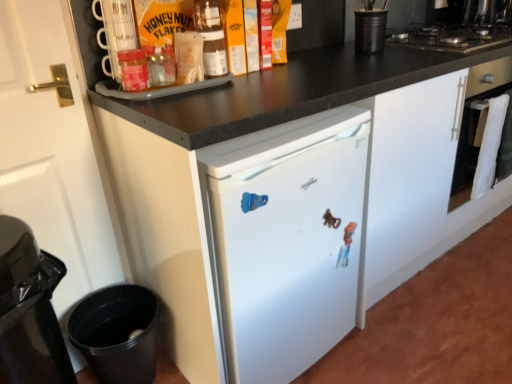
Describe the element at coordinates (133, 69) in the screenshot. The width and height of the screenshot is (512, 384). I see `matte glass jar at upper left, placed as the 1th bottle when sorted from front to back` at that location.

Measure the distance between point [140,70] and camera.

1.16 meters.

Where is `white matte door at left`? The height and width of the screenshot is (384, 512). white matte door at left is located at coordinates (54, 153).

Find the location of a particular element. This screenshot has height=384, width=512. white glossy oven at right is located at coordinates (479, 147).

Measure the distance between point [382,26] and camera.

Point [382,26] is 1.57 meters away from camera.

What do you see at coordinates (452, 37) in the screenshot? I see `black matte gas stove at upper right` at bounding box center [452, 37].

Where is `black plastic trash can at lower left, placed as the 1th appliance when sorted from bottom to top`? The image size is (512, 384). black plastic trash can at lower left, placed as the 1th appliance when sorted from bottom to top is located at coordinates click(117, 333).

Measure the distance between point (210, 66) and camera.

Point (210, 66) is 4.16 feet from camera.

In order to face matte glass honey jar at upper center, which ranks as the 1th bottle in top-to-bottom order, should I rotate leftwards or rightwards?

It's best to rotate left around 5.035 degrees.

Locate an element on the screen. This screenshot has width=512, height=384. matte glass jar at upper left, positioned as the 1th bottle in bottom-to-top order is located at coordinates (133, 69).

Is the surface of black matte cup at upper right, marked as the second appliance in a bottom-to-top arrangement, in direct contact with matte glass honey jar at upper center, positioned as the 1th bottle in right-to-left order?

black matte cup at upper right, marked as the second appliance in a bottom-to-top arrangement, and matte glass honey jar at upper center, positioned as the 1th bottle in right-to-left order, are clearly separated.

Is black matte cup at upper right, which is counted as the 2th appliance, starting from the left, taller than matte glass honey jar at upper center, which is the first bottle in back-to-front order?

No, black matte cup at upper right, which is counted as the 2th appliance, starting from the left, is not taller than matte glass honey jar at upper center, which is the first bottle in back-to-front order.

From the image's perspective, does black matte cup at upper right, which ranks as the first appliance in right-to-left order, appear lower than matte glass honey jar at upper center, which ranks as the 1th bottle in top-to-bottom order?

Actually, black matte cup at upper right, which ranks as the first appliance in right-to-left order, appears above matte glass honey jar at upper center, which ranks as the 1th bottle in top-to-bottom order, in the image.

In the scene shown: Between matte glass jar at upper left, which is counted as the 2th bottle, starting from the back, and plastic toy at center, which one appears on the left side from the viewer's perspective?

From the viewer's perspective, matte glass jar at upper left, which is counted as the 2th bottle, starting from the back, appears more on the left side.

Can you confirm if matte glass jar at upper left, which is the 2th bottle in top-to-bottom order, is wider than plastic toy at center?

Indeed, matte glass jar at upper left, which is the 2th bottle in top-to-bottom order, has a greater width compared to plastic toy at center.

How much distance is there between matte glass jar at upper left, the first bottle positioned from the left, and plastic toy at center?

matte glass jar at upper left, the first bottle positioned from the left, is 30.04 inches from plastic toy at center.

From a real-world perspective, does matte glass jar at upper left, positioned as the 1th bottle in bottom-to-top order, sit lower than plastic toy at center?

Actually, matte glass jar at upper left, positioned as the 1th bottle in bottom-to-top order, is physically above plastic toy at center in the real world.

Does matte glass honey jar at upper center, which is the first bottle in back-to-front order, have a lesser height compared to black plastic trash can at lower left, placed as the 1th appliance when sorted from bottom to top?

Indeed, matte glass honey jar at upper center, which is the first bottle in back-to-front order, has a lesser height compared to black plastic trash can at lower left, placed as the 1th appliance when sorted from bottom to top.

Choose the correct answer: Is matte glass honey jar at upper center, which appears as the 2th bottle when viewed from the front, inside black plastic trash can at lower left, positioned as the second appliance in top-to-bottom order, or outside it?

matte glass honey jar at upper center, which appears as the 2th bottle when viewed from the front, is not inside black plastic trash can at lower left, positioned as the second appliance in top-to-bottom order, it's outside.

Is matte glass honey jar at upper center, which appears as the 2th bottle when viewed from the front, wider or thinner than black plastic trash can at lower left, the first appliance positioned from the left?

Clearly, matte glass honey jar at upper center, which appears as the 2th bottle when viewed from the front, has less width compared to black plastic trash can at lower left, the first appliance positioned from the left.

Is matte glass honey jar at upper center, which ranks as the 1th bottle in top-to-bottom order, behind black plastic trash can at lower left, arranged as the second appliance when viewed from the right?

Yes, matte glass honey jar at upper center, which ranks as the 1th bottle in top-to-bottom order, is behind black plastic trash can at lower left, arranged as the second appliance when viewed from the right.

From a real-world perspective, is white matte door at left physically above black matte gas stove at upper right?

Incorrect, from a real-world perspective, white matte door at left is lower than black matte gas stove at upper right.

Considering the positions of points (98, 205) and (465, 36), is point (98, 205) farther from camera compared to point (465, 36)?

No, (98, 205) is closer to viewer.

Image resolution: width=512 pixels, height=384 pixels. I want to click on gas stove lying above the white matte door at left (from the image's perspective), so click(452, 37).

Is white matte door at left facing towards black matte gas stove at upper right?

No, white matte door at left is not turned towards black matte gas stove at upper right.

Are matte glass honey jar at upper center, which is counted as the second bottle, starting from the bottom, and black matte cup at upper right, marked as the second appliance in a bottom-to-top arrangement, beside each other?

No, matte glass honey jar at upper center, which is counted as the second bottle, starting from the bottom, is not beside black matte cup at upper right, marked as the second appliance in a bottom-to-top arrangement.

From a real-world perspective, is matte glass honey jar at upper center, which ranks as the 1th bottle in top-to-bottom order, positioned under black matte cup at upper right, which ranks as the first appliance in right-to-left order, based on gravity?

No.

Considering the positions of point (200, 11) and point (360, 25), is point (200, 11) closer or farther from the camera than point (360, 25)?

Point (200, 11) is positioned closer to the camera compared to point (360, 25).

From the image's perspective, is black glossy trash can at lower left beneath black matte cup at upper right, marked as the second appliance in a bottom-to-top arrangement?

Correct, black glossy trash can at lower left appears lower than black matte cup at upper right, marked as the second appliance in a bottom-to-top arrangement, in the image.

Is black glossy trash can at lower left next to black matte cup at upper right, which ranks as the first appliance in right-to-left order?

No, black glossy trash can at lower left is not with black matte cup at upper right, which ranks as the first appliance in right-to-left order.

Is black matte cup at upper right, marked as the second appliance in a bottom-to-top arrangement, inside black glossy trash can at lower left?

No, black glossy trash can at lower left does not contain black matte cup at upper right, marked as the second appliance in a bottom-to-top arrangement.

Is plastic toy at center at the back of black glossy trash can at lower left?

No, black glossy trash can at lower left is not facing away from plastic toy at center.

From a real-world perspective, is black glossy trash can at lower left positioned above or below plastic toy at center?

In terms of real-world spatial position, black glossy trash can at lower left is below plastic toy at center.

How different are the orientations of black glossy trash can at lower left and plastic toy at center in degrees?

0.472 degrees separate the facing orientations of black glossy trash can at lower left and plastic toy at center.

Would you say black glossy trash can at lower left is inside or outside plastic toy at center?

black glossy trash can at lower left exists outside the volume of plastic toy at center.

The width and height of the screenshot is (512, 384). In the image, there is a matte glass honey jar at upper center, positioned as the 1th bottle in right-to-left order. Find the location of `appliance above it (from the image's perspective)`. appliance above it (from the image's perspective) is located at coordinates (370, 30).

Starting from the plastic toy at center, which bottle is the 2nd one to the left? Please provide its 2D coordinates.

[(133, 69)]

Considering their positions, is matte glass honey jar at upper center, which appears as the 2th bottle when viewed from the front, positioned further to matte glass jar at upper left, the first bottle positioned from the left, than white matte door at left?

white matte door at left.

From the image, which object appears to be farther from plastic toy at center, white matte door at left or matte glass jar at upper left, the first bottle positioned from the left?

Among the two, white matte door at left is located further to plastic toy at center.

Considering their positions, is plastic toy at center positioned closer to matte glass jar at upper left, which is counted as the 2th bottle, starting from the back, than white matte door at left?

white matte door at left is positioned closer to the anchor matte glass jar at upper left, which is counted as the 2th bottle, starting from the back.

Looking at the image, which one is located further to plastic toy at center, black matte cup at upper right, the first appliance from the top, or black matte gas stove at upper right?

Among the two, black matte gas stove at upper right is located further to plastic toy at center.

Looking at the image, which one is located further to matte glass jar at upper left, placed as the 1th bottle when sorted from front to back, black glossy trash can at lower left or white glossy oven at right?

white glossy oven at right is further to matte glass jar at upper left, placed as the 1th bottle when sorted from front to back.

Considering their positions, is white matte door at left positioned closer to matte glass honey jar at upper center, which ranks as the 1th bottle in top-to-bottom order, than plastic toy at center?

white matte door at left lies closer to matte glass honey jar at upper center, which ranks as the 1th bottle in top-to-bottom order, than the other object.

When comparing their distances from plastic toy at center, does white glossy oven at right or black plastic trash can at lower left, placed as the 1th appliance when sorted from bottom to top, seem closer?

The object closer to plastic toy at center is white glossy oven at right.

Based on their spatial positions, is white matte door at left or white glossy oven at right further from black matte gas stove at upper right?

white matte door at left.

This screenshot has width=512, height=384. In order to click on door situated between black glossy trash can at lower left and black matte gas stove at upper right from left to right in this screenshot , I will do `click(54, 153)`.

The image size is (512, 384). What are the coordinates of `appliance between black matte gas stove at upper right and black plastic trash can at lower left, placed as the 1th appliance when sorted from bottom to top, from top to bottom` in the screenshot? It's located at (370, 30).

Where is `toy between matte glass honey jar at upper center, which is counted as the second bottle, starting from the bottom, and black glossy trash can at lower left, in the vertical direction`? toy between matte glass honey jar at upper center, which is counted as the second bottle, starting from the bottom, and black glossy trash can at lower left, in the vertical direction is located at coordinates (346, 245).

This screenshot has height=384, width=512. In order to click on gas stove between matte glass honey jar at upper center, the second bottle positioned from the left, and white glossy oven at right in this screenshot , I will do `click(452, 37)`.